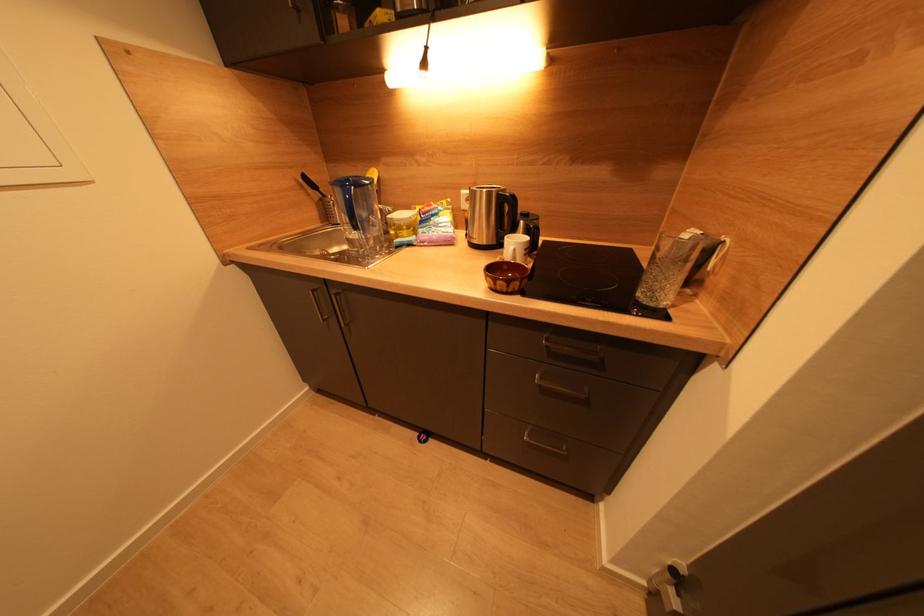
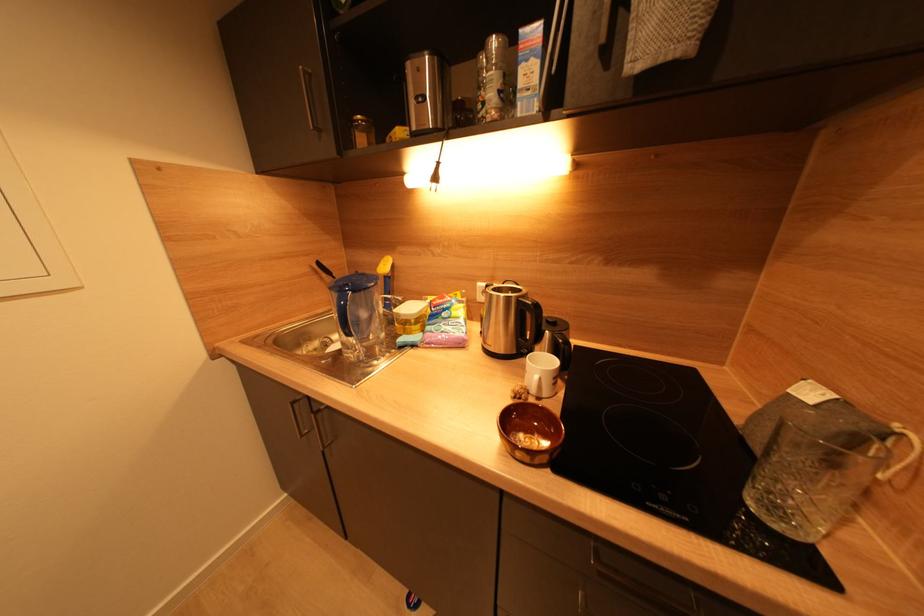
Question: The images are taken continuously from a first-person perspective. In which direction is your viewpoint rotating?

Choices:
 (A) Left
 (B) Right
 (C) Up
 (D) Down

Answer: (C)